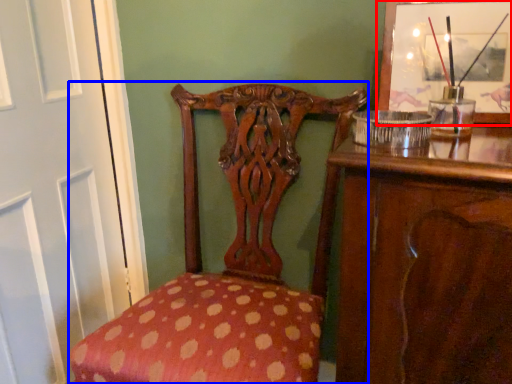
Question: Which object appears closest to the camera in this image, picture frame (highlighted by a red box) or chair (highlighted by a blue box)?

Choices:
 (A) picture frame
 (B) chair

Answer: (B)